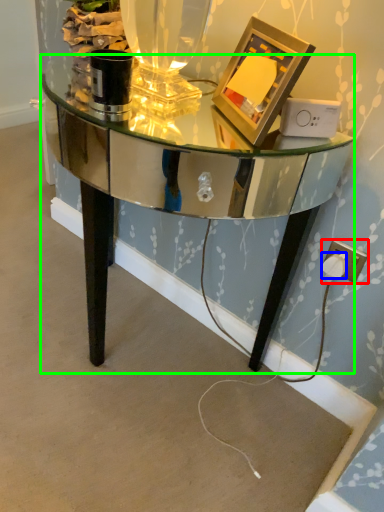
Question: Estimate the real-world distances between objects in this image. Which object is closer to electric outlet (highlighted by a red box), plug (highlighted by a blue box) or table (highlighted by a green box)?

Choices:
 (A) plug
 (B) table

Answer: (A)